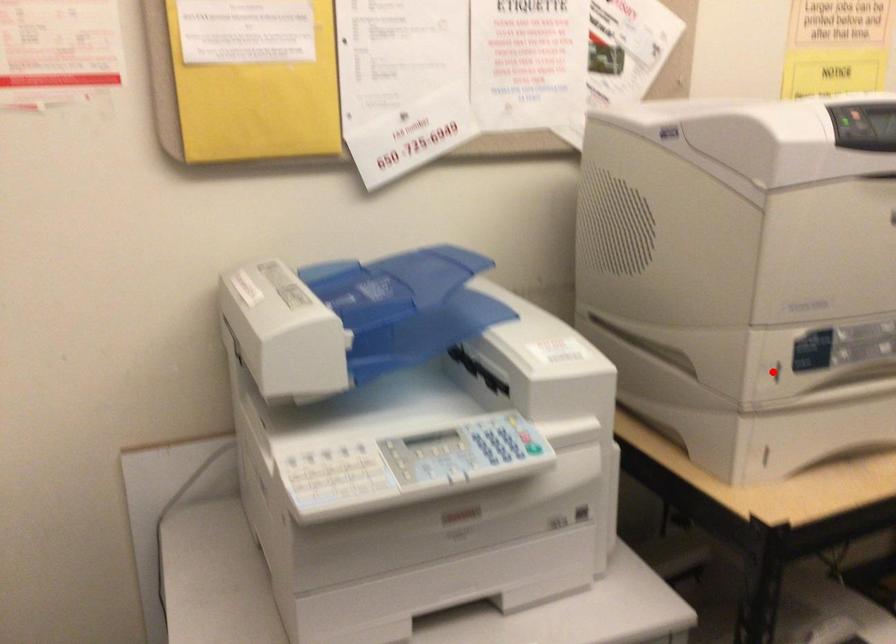
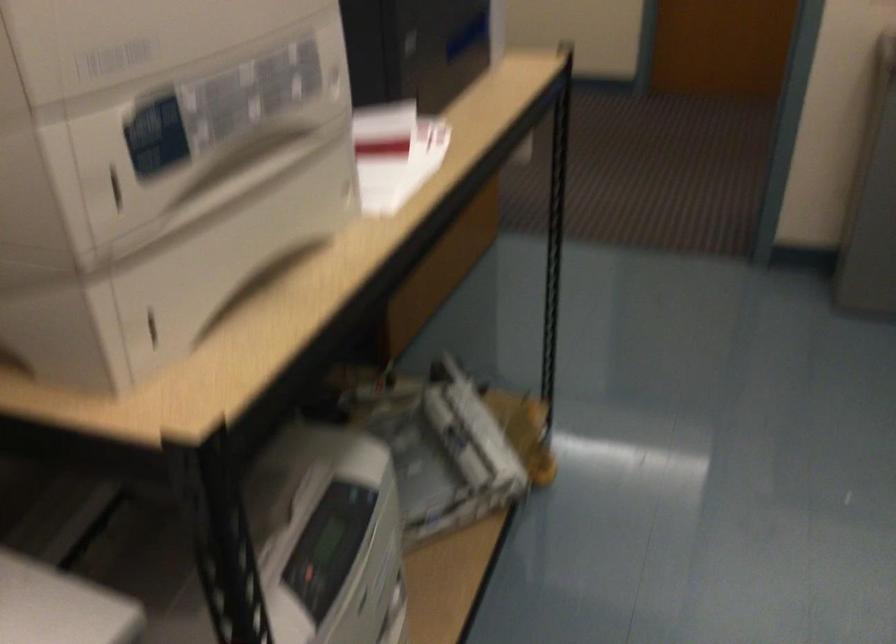
Find the pixel in the second image that matches the highlighted location in the first image.

(116, 189)